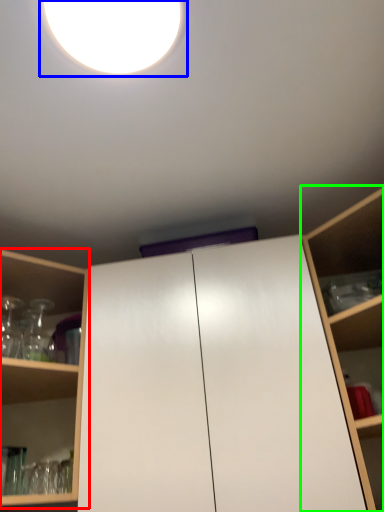
Question: Which is farther away from shelf (highlighted by a red box)? droplight (highlighted by a blue box) or shelf (highlighted by a green box)?

Choices:
 (A) droplight
 (B) shelf

Answer: (A)